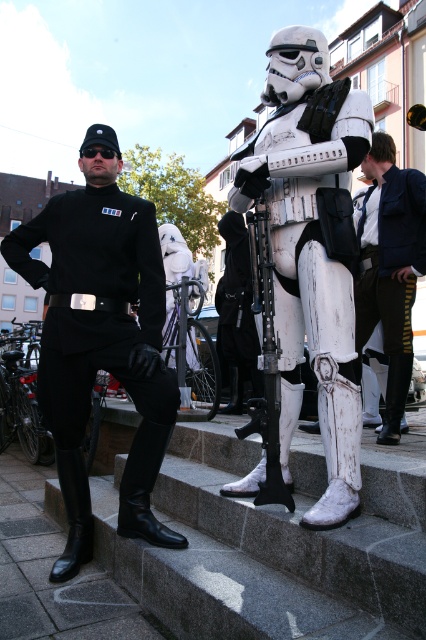
You are a photographer positioned at the front of the steps. You want to take a photo where both the black matte uniform at center and the white matte stormtrooper at center are clearly visible. Which character should you move forward to ensure both are visible?

The white matte stormtrooper at center is behind the black matte uniform at center. To ensure both are visible, move the white matte stormtrooper at center forward so it is in front of the black matte uniform at center.

You are standing at the origin point of the coordinate system. You see two points in the image, point (x=356, y=99) and point (x=80, y=451). Which point is closer to you?

Point (x=356, y=99) is in front of point (x=80, y=451), so it is closer to you.

You are a costume designer examining the image. You need to determine the spatial relationship between the shiny blue vest at center and the black leather boot at lower left. Which object is placed higher in the image?

The shiny blue vest at center is positioned over the black leather boot at lower left, so it is placed higher in the image.